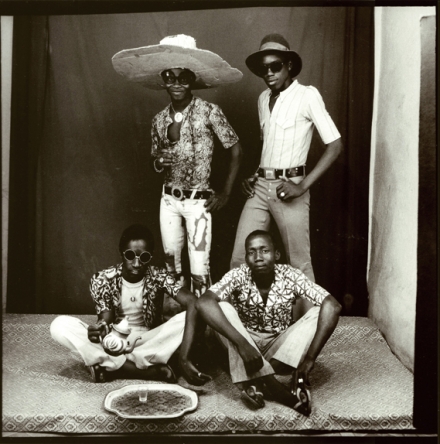
You are a GUI agent. You are given a task and a screenshot of the screen. Output one action in this format:
    pyautogui.click(x=<x>, y=<y>)
    Task: Click on the gray blanket
    This screenshot has width=440, height=444.
    Given the screenshot: What is the action you would take?
    pyautogui.click(x=37, y=402)